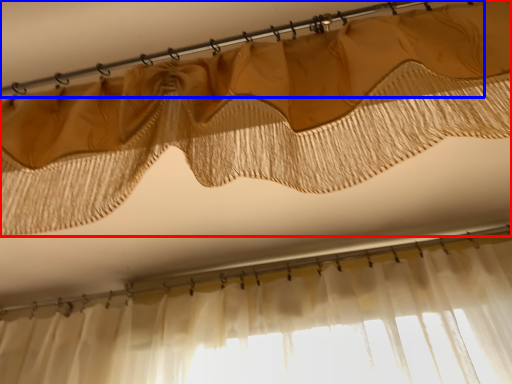
Question: Which object is further to the camera taking this photo, curtain (highlighted by a red box) or clothesline (highlighted by a blue box)?

Choices:
 (A) curtain
 (B) clothesline

Answer: (B)